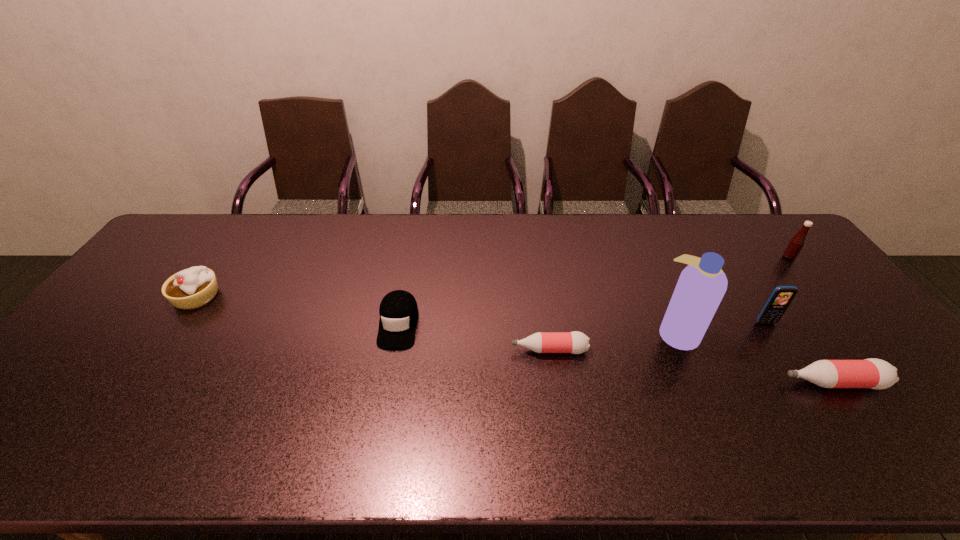
Locate an element on the screen. This screenshot has width=960, height=540. free location at the far edge of the desktop is located at coordinates (518, 230).

At what (x,y) coordinates should I click in order to perform the action: click on free space at the near edge of the desktop. Please return your answer as a coordinate pair (x, y). Looking at the image, I should click on (263, 397).

Locate an element on the screen. Image resolution: width=960 pixels, height=540 pixels. free space at the left edge is located at coordinates (158, 318).

This screenshot has height=540, width=960. Identify the location of free spot at the far left corner of the desktop. (204, 244).

Find the location of a particular element. free space at the near left corner of the desktop is located at coordinates (37, 390).

You are a GUI agent. You are given a task and a screenshot of the screen. Output one action in this format:
    pyautogui.click(x=<x>, y=<y>)
    Task: Click on the free space at the far right corner
    The image size is (960, 540).
    Given the screenshot: What is the action you would take?
    789,240

Where is `blank region between the nearest object and the tallest object`? This screenshot has height=540, width=960. blank region between the nearest object and the tallest object is located at coordinates (755, 358).

I want to click on unoccupied area between the sixth object from right to left and the cellular telephone, so click(x=582, y=323).

At what (x,y) coordinates should I click in order to perform the action: click on vacant area that lies between the cap and the whipped cream. Please return your answer as a coordinate pair (x, y). Looking at the image, I should click on (298, 310).

The width and height of the screenshot is (960, 540). Find the location of `vacant point located between the nearer bottle and the second object from left to right`. vacant point located between the nearer bottle and the second object from left to right is located at coordinates (615, 354).